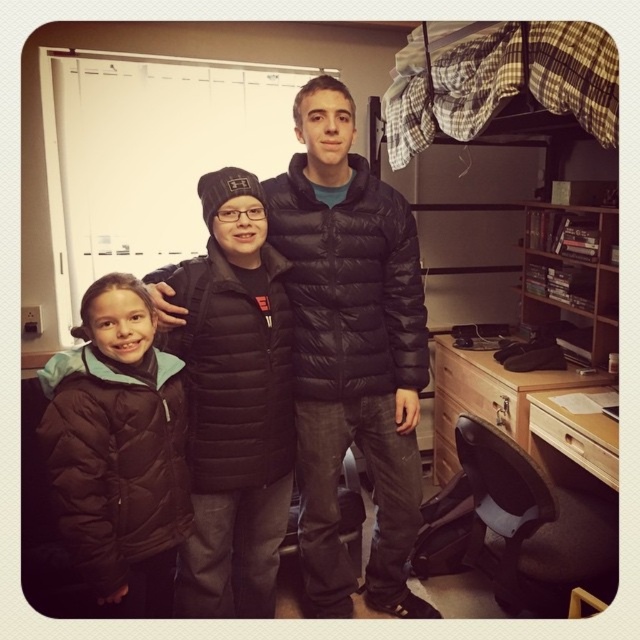
Who is lower down, matte black jacket at center or brown puffy jacket at left?

brown puffy jacket at left is below.

Can you confirm if matte black jacket at center is positioned above brown puffy jacket at left?

Correct, matte black jacket at center is located above brown puffy jacket at left.

Between point (228, 168) and point (144, 486), which one is positioned in front?

Point (144, 486)

What are the coordinates of `matte black jacket at center` in the screenshot? It's located at (232, 401).

In the scene shown: Between black puffer jacket at center and brown puffy jacket at left, which one appears on the right side from the viewer's perspective?

black puffer jacket at center

Locate an element on the screen. black puffer jacket at center is located at coordinates (349, 349).

Does point (396, 428) come behind point (108, 412)?

Yes, point (396, 428) is farther from viewer.

I want to click on black puffer jacket at center, so click(349, 349).

Does black puffer jacket at center have a greater height compared to matte black jacket at center?

Indeed, black puffer jacket at center has a greater height compared to matte black jacket at center.

Who is positioned more to the right, black puffer jacket at center or matte black jacket at center?

black puffer jacket at center

Find the location of a particular element. This screenshot has width=640, height=640. black puffer jacket at center is located at coordinates (349, 349).